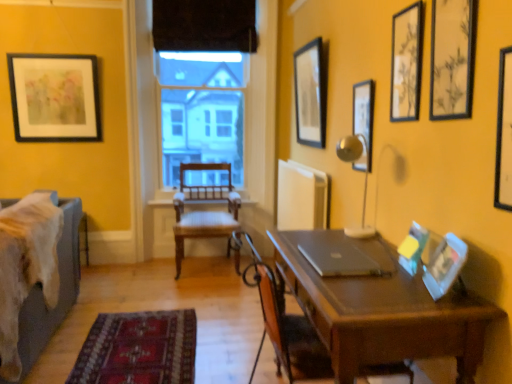
Measure the distance between matte black picture frame at upper center, the second picture frame positioned from the back, and camera.

The distance of matte black picture frame at upper center, the second picture frame positioned from the back, from camera is 10.11 feet.

The width and height of the screenshot is (512, 384). I want to click on wooden chair at center, so click(x=145, y=141).

Between matte plastic picture frame at right, marked as the second picture frame in a front-to-back arrangement, and brown wooden chair at center, placed as the 1th chair when sorted from front to back, which one appears on the right side from the viewer's perspective?

matte plastic picture frame at right, marked as the second picture frame in a front-to-back arrangement, is more to the right.

From a real-world perspective, is matte plastic picture frame at right, marked as the second picture frame in a front-to-back arrangement, on brown wooden chair at center, arranged as the second chair when viewed from the left?

Indeed, from a real-world perspective, matte plastic picture frame at right, marked as the second picture frame in a front-to-back arrangement, stands above brown wooden chair at center, arranged as the second chair when viewed from the left.

Is brown wooden chair at center, arranged as the second chair when viewed from the left, at the back of matte plastic picture frame at right, placed as the seventh picture frame when sorted from back to front?

No.

Between matte plastic picture frame at right, which appears as the fifth picture frame when viewed from the left, and brown wooden chair at center, arranged as the second chair when viewed from the left, which one has smaller size?

With smaller size is matte plastic picture frame at right, which appears as the fifth picture frame when viewed from the left.

From a real-world perspective, which object stands above the other?

transparent glass window at center, from a real-world perspective.

Can you confirm if transparent glass window at center is bigger than matte black picture frame at upper left, the first picture frame positioned from the back?

Correct, transparent glass window at center is larger in size than matte black picture frame at upper left, the first picture frame positioned from the back.

Looking at their sizes, would you say transparent glass window at center is wider or thinner than matte black picture frame at upper left, which appears as the 8th picture frame when viewed from the right?

Considering their sizes, transparent glass window at center looks broader than matte black picture frame at upper left, which appears as the 8th picture frame when viewed from the right.

Where is `window on the right of matte black picture frame at upper left, placed as the 1th picture frame when sorted from left to right`? window on the right of matte black picture frame at upper left, placed as the 1th picture frame when sorted from left to right is located at coordinates (202, 111).

At what (x,y) coordinates should I click in order to perform the action: click on picture frame on the left of white glossy radiator at center. Please return your answer as a coordinate pair (x, y). This screenshot has width=512, height=384. Looking at the image, I should click on pyautogui.click(x=55, y=97).

Is white glossy radiator at center at the right side of matte black picture frame at upper left, placed as the eighth picture frame when sorted from front to back?

Correct, you'll find white glossy radiator at center to the right of matte black picture frame at upper left, placed as the eighth picture frame when sorted from front to back.

Consider the image. Can you tell me how much white glossy radiator at center and matte black picture frame at upper left, placed as the 1th picture frame when sorted from left to right, differ in facing direction?

The angle between the facing direction of white glossy radiator at center and the facing direction of matte black picture frame at upper left, placed as the 1th picture frame when sorted from left to right, is 90.4 degrees.

Considering the sizes of objects white glossy radiator at center and matte black picture frame at upper left, placed as the 1th picture frame when sorted from left to right, in the image provided, who is smaller, white glossy radiator at center or matte black picture frame at upper left, placed as the 1th picture frame when sorted from left to right,?

matte black picture frame at upper left, placed as the 1th picture frame when sorted from left to right.

Which of these two, matte black picture frame at upper center, acting as the 2th picture frame starting from the left, or matte plastic picture frame at right, which appears as the fourth picture frame when viewed from the right, is wider?

With larger width is matte plastic picture frame at right, which appears as the fourth picture frame when viewed from the right.

In the image, is matte black picture frame at upper center, the 7th picture frame when ordered from front to back, positioned in front of or behind matte plastic picture frame at right, which appears as the fourth picture frame when viewed from the right?

matte black picture frame at upper center, the 7th picture frame when ordered from front to back, is positioned farther from the viewer than matte plastic picture frame at right, which appears as the fourth picture frame when viewed from the right.

Does matte black picture frame at upper center, acting as the 7th picture frame starting from the right, appear on the right side of matte plastic picture frame at right, which appears as the fourth picture frame when viewed from the right?

Incorrect, matte black picture frame at upper center, acting as the 7th picture frame starting from the right, is not on the right side of matte plastic picture frame at right, which appears as the fourth picture frame when viewed from the right.

Considering the relative sizes of matte black picture frame at upper center, acting as the 7th picture frame starting from the right, and matte plastic picture frame at right, which appears as the fifth picture frame when viewed from the left, in the image provided, is matte black picture frame at upper center, acting as the 7th picture frame starting from the right, taller than matte plastic picture frame at right, which appears as the fifth picture frame when viewed from the left,?

Indeed, matte black picture frame at upper center, acting as the 7th picture frame starting from the right, has a greater height compared to matte plastic picture frame at right, which appears as the fifth picture frame when viewed from the left.

Could you tell me if wooden picture frame at upper right, marked as the 8th picture frame in a left-to-right arrangement, is turned towards brown wooden chair at center, which ranks as the 2th chair in back-to-front order?

No, wooden picture frame at upper right, marked as the 8th picture frame in a left-to-right arrangement, is not oriented towards brown wooden chair at center, which ranks as the 2th chair in back-to-front order.

From the picture: From their relative heights in the image, would you say wooden picture frame at upper right, which ranks as the first picture frame in right-to-left order, is taller or shorter than brown wooden chair at center, arranged as the second chair when viewed from the left?

Considering their sizes, wooden picture frame at upper right, which ranks as the first picture frame in right-to-left order, has less height than brown wooden chair at center, arranged as the second chair when viewed from the left.

From the picture: From a real-world perspective, which object rests below the other?

brown wooden chair at center, which is the 1th chair from right to left, is physically lower.

Is wooden picture frame at upper right, the 1th picture frame positioned from the front, bigger or smaller than brown wooden chair at center, placed as the 1th chair when sorted from front to back?

Considering their sizes, wooden picture frame at upper right, the 1th picture frame positioned from the front, takes up less space than brown wooden chair at center, placed as the 1th chair when sorted from front to back.

I want to click on picture frame that is the 2nd object above the transparent glass window at center (from a real-world perspective), so click(406, 63).

Considering the positions of point (394, 36) and point (177, 111), is point (394, 36) closer or farther from the camera than point (177, 111)?

Point (394, 36) is positioned closer to the camera compared to point (177, 111).

Does wooden picture frame at upper right, acting as the 3th picture frame starting from the right, have a lesser width compared to transparent glass window at center?

Yes.

Would you say wooden picture frame at upper right, which appears as the fifth picture frame when viewed from the front, is to the left or to the right of transparent glass window at center in the picture?

wooden picture frame at upper right, which appears as the fifth picture frame when viewed from the front, is positioned on transparent glass window at center's right side.

Identify the location of the 2nd chair positioned below the wooden picture frame at upper right, acting as the 3th picture frame starting from the right (from a real-world perspective). The height and width of the screenshot is (384, 512). pyautogui.click(x=204, y=211).

From a real-world perspective, does wooden picture frame at upper right, acting as the sixth picture frame starting from the left, sit lower than wooden chair with cushion at center, positioned as the second chair in right-to-left order?

No, from a real-world perspective, wooden picture frame at upper right, acting as the sixth picture frame starting from the left, is not beneath wooden chair with cushion at center, positioned as the second chair in right-to-left order.

From the image's perspective, is wooden picture frame at upper right, acting as the sixth picture frame starting from the left, located beneath wooden chair with cushion at center, positioned as the second chair in right-to-left order?

No.

Does wooden picture frame at upper right, acting as the sixth picture frame starting from the left, have a smaller size compared to wooden chair with cushion at center, the first chair positioned from the left?

Correct, wooden picture frame at upper right, acting as the sixth picture frame starting from the left, occupies less space than wooden chair with cushion at center, the first chair positioned from the left.

There is a matte plastic picture frame at right, marked as the second picture frame in a front-to-back arrangement. At what (x,y) coordinates should I click in order to perform the action: click on the 1st chair below it (from a real-world perspective). Please return your answer as a coordinate pair (x, y). The image size is (512, 384). Looking at the image, I should click on (288, 333).

Locate an element on the screen. The height and width of the screenshot is (384, 512). picture frame on the left of transparent glass window at center is located at coordinates (55, 97).

Which object lies further to the anchor point brown wooden chair at center, which is the 1th chair from right to left, matte plastic picture frame at right, placed as the seventh picture frame when sorted from back to front, or matte black picture frame at upper right, which appears as the 3th picture frame when viewed from the left?

matte black picture frame at upper right, which appears as the 3th picture frame when viewed from the left, is positioned further to the anchor brown wooden chair at center, which is the 1th chair from right to left.

Estimate the real-world distances between objects in this image. Which object is further from sleek silver laptop at center, black velvet curtain at upper center or matte brown desk at center?

black velvet curtain at upper center is positioned further to the anchor sleek silver laptop at center.

Which object lies further to the anchor point matte plastic picture frame at right, acting as the fourth picture frame starting from the front, wooden picture frame at upper right, which appears as the fifth picture frame when viewed from the front, or wooden picture frame at upper right, positioned as the eighth picture frame in back-to-front order?

Among the two, wooden picture frame at upper right, which appears as the fifth picture frame when viewed from the front, is located further to matte plastic picture frame at right, acting as the fourth picture frame starting from the front.

Which object lies nearer to the anchor point velvet blue bed at left, brown wooden chair at center, placed as the 1th chair when sorted from front to back, or matte plastic picture frame at right, marked as the second picture frame in a front-to-back arrangement?

Based on the image, brown wooden chair at center, placed as the 1th chair when sorted from front to back, appears to be nearer to velvet blue bed at left.

From the image, which object appears to be nearer to matte plastic picture frame at right, placed as the seventh picture frame when sorted from back to front, white glossy radiator at center or matte black picture frame at upper right, positioned as the 6th picture frame in right-to-left order?

The object closer to matte plastic picture frame at right, placed as the seventh picture frame when sorted from back to front, is matte black picture frame at upper right, positioned as the 6th picture frame in right-to-left order.

Based on their spatial positions, is matte plastic picture frame at right, which appears as the fourth picture frame when viewed from the right, or white glossy radiator at center closer to wooden chair at center?

white glossy radiator at center lies closer to wooden chair at center than the other object.

Which object lies nearer to the anchor point brown wooden chair at center, which ranks as the 2th chair in back-to-front order, wooden picture frame at upper right, marked as the 8th picture frame in a left-to-right arrangement, or matte black picture frame at upper left, which appears as the 8th picture frame when viewed from the right?

wooden picture frame at upper right, marked as the 8th picture frame in a left-to-right arrangement, is positioned closer to the anchor brown wooden chair at center, which ranks as the 2th chair in back-to-front order.

Consider the image. Considering their positions, is matte black picture frame at upper right, which is the third picture frame in back-to-front order, positioned further to wooden picture frame at upper right, which appears as the fifth picture frame when viewed from the front, than matte brown desk at center?

The object further to wooden picture frame at upper right, which appears as the fifth picture frame when viewed from the front, is matte brown desk at center.

Locate an element on the screen. bed between matte black picture frame at upper left, the first picture frame positioned from the back, and matte black picture frame at upper center, acting as the 2th picture frame starting from the left is located at coordinates (60, 288).

Locate an element on the screen. bed between matte plastic picture frame at right, the 4th picture frame when ordered from left to right, and black velvet curtain at upper center from front to back is located at coordinates (60, 288).

Where is `window between black velvet curtain at upper center and wooden chair at center in the vertical direction`? Image resolution: width=512 pixels, height=384 pixels. window between black velvet curtain at upper center and wooden chair at center in the vertical direction is located at coordinates (202, 111).

Locate an element on the screen. This screenshot has height=384, width=512. window that lies between black velvet curtain at upper center and wooden chair with cushion at center, the first chair positioned from the left, from top to bottom is located at coordinates pyautogui.click(x=202, y=111).